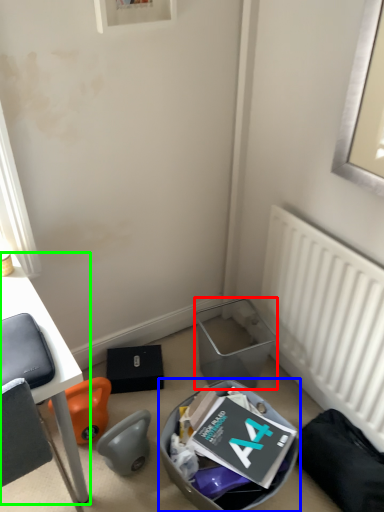
Question: Estimate the real-world distances between objects in this image. Which object is farther from trash bin/can (highlighted by a red box), trash bin/can (highlighted by a blue box) or desk (highlighted by a green box)?

Choices:
 (A) trash bin/can
 (B) desk

Answer: (B)